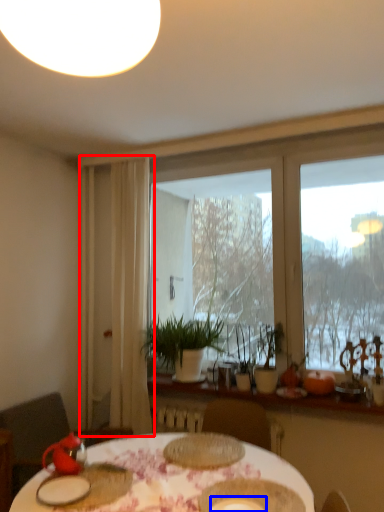
Question: Which point is further to the camera, curtain (highlighted by a red box) or tableware (highlighted by a blue box)?

Choices:
 (A) curtain
 (B) tableware

Answer: (A)